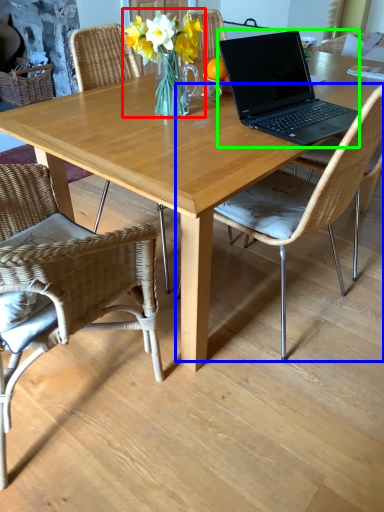
Question: Estimate the real-world distances between objects in this image. Which object is farther from floral arrangement (highlighted by a red box), chair (highlighted by a blue box) or laptop (highlighted by a green box)?

Choices:
 (A) chair
 (B) laptop

Answer: (A)